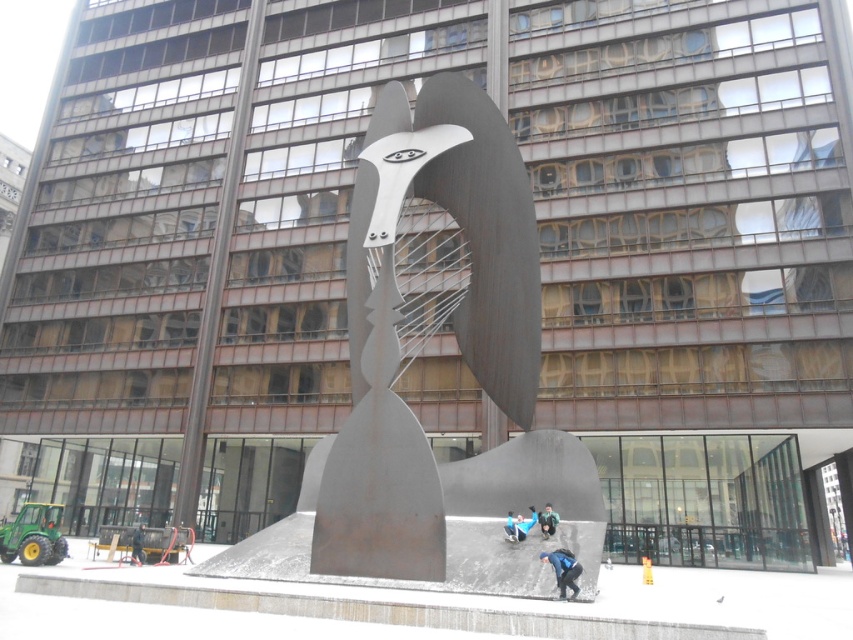
You are a visitor standing in front of the modern building. You see the rusty metal sculpture at center and the dark blue jeans at center. Which object is closer to you?

The rusty metal sculpture at center is positioned over dark blue jeans at center, meaning it is closer to you.

You are an art student visiting the sculpture garden. You notice the rusty metal sculpture at center and the blue fabric at lower center. From your vantage point, which object is closer to you?

The rusty metal sculpture at center is closer to you because the blue fabric at lower center is behind it.

You are standing in front of the sculpture and see a blue fabric at lower center and dark blue jeans at center. Which item is located to the left of the other?

The blue fabric at lower center is positioned on the left side of dark blue jeans at center.